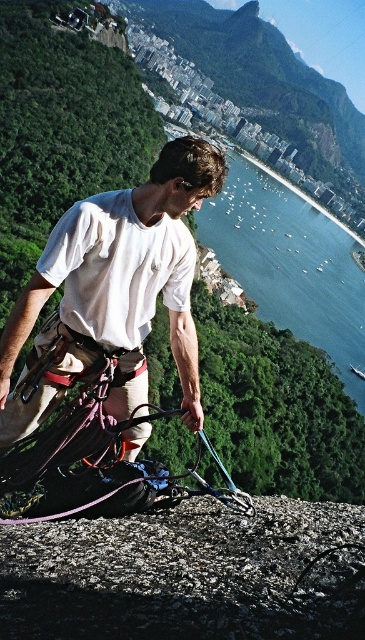
You are a climber assessing the route ahead. You notice the smooth gray rock at center and the blue water at center. Which object is shorter in height?

The smooth gray rock at center is shorter in height compared to the blue water at center.

You are a photographer capturing the climber and the city from a drone. You need to focus on both the point at coordinates point (118, 582) and the point at coordinates point (313, 209). Which point should you focus on first to ensure both are in sharp focus?

You should focus on point (313, 209) first because it is farther from the camera than point (118, 582). By focusing on the farther point, the closer point will also be within the depth of field.